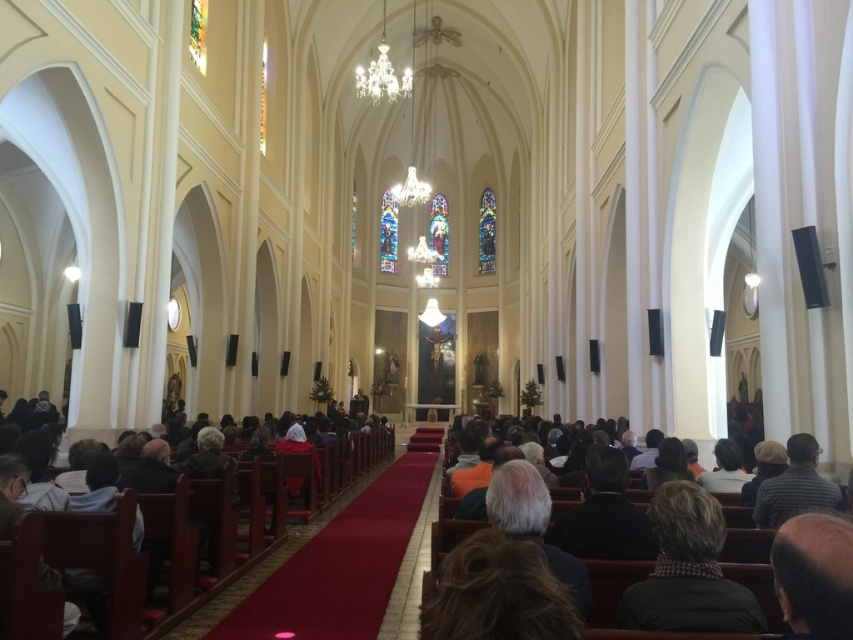
Looking at this image, which is more to the right, dark brown leather jacket at lower right or dark brown leather jacket at center?

From the viewer's perspective, dark brown leather jacket at lower right appears more on the right side.

Between dark brown leather jacket at lower right and dark brown leather jacket at center, which one is positioned lower?

dark brown leather jacket at center is below.

What do you see at coordinates (688, 572) in the screenshot? I see `dark brown leather jacket at lower right` at bounding box center [688, 572].

Where is `dark brown leather jacket at lower right`? The height and width of the screenshot is (640, 853). dark brown leather jacket at lower right is located at coordinates (688, 572).

Where is `dark brown leather jacket at lower right`? This screenshot has height=640, width=853. dark brown leather jacket at lower right is located at coordinates click(x=688, y=572).

Is dark brown leather jacket at lower right closer to camera compared to dark brown wooden pew at center?

Yes, dark brown leather jacket at lower right is in front of dark brown wooden pew at center.

Who is more distant from viewer, (708,564) or (300,516)?

The point (300,516) is behind.

Where is `dark brown leather jacket at lower right`? Image resolution: width=853 pixels, height=640 pixels. dark brown leather jacket at lower right is located at coordinates (688, 572).

The height and width of the screenshot is (640, 853). Find the location of `dark brown leather jacket at center`. dark brown leather jacket at center is located at coordinates (751, 566).

Image resolution: width=853 pixels, height=640 pixels. What are the coordinates of `dark brown leather jacket at center` in the screenshot? It's located at (751, 566).

Where is `dark brown leather jacket at center`? The width and height of the screenshot is (853, 640). dark brown leather jacket at center is located at coordinates (751, 566).